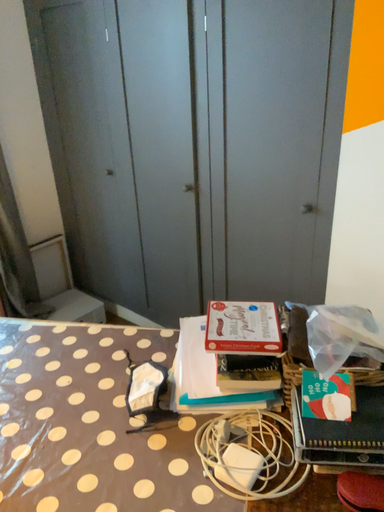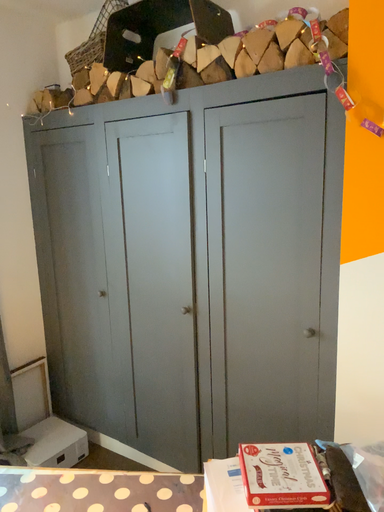
Question: Which way did the camera rotate in the video?

Choices:
 (A) rotated downward
 (B) rotated upward

Answer: (B)